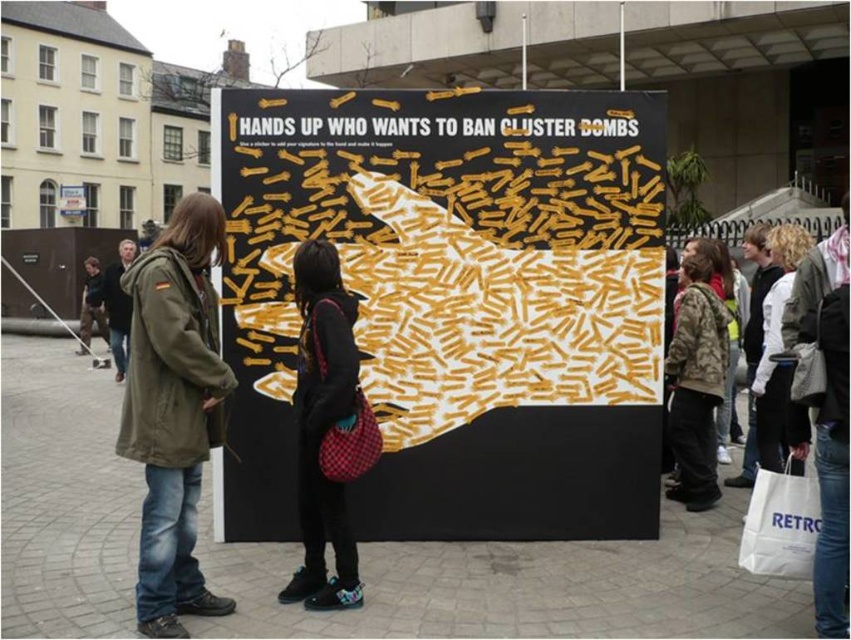
Does yellow paper cluster bombs at center have a smaller size compared to camouflage jacket at center?

No.

Is yellow paper cluster bombs at center to the right of camouflage jacket at center from the viewer's perspective?

Incorrect, yellow paper cluster bombs at center is not on the right side of camouflage jacket at center.

You are a GUI agent. You are given a task and a screenshot of the screen. Output one action in this format:
    pyautogui.click(x=<x>, y=<y>)
    Task: Click on the yellow paper cluster bombs at center
    
    Given the screenshot: What is the action you would take?
    pyautogui.click(x=455, y=304)

Is point (146, 596) more distant than point (706, 497)?

No, (146, 596) is closer to viewer.

Who is more distant from viewer, [181,288] or [721,385]?

Positioned behind is point [721,385].

You are a GUI agent. You are given a task and a screenshot of the screen. Output one action in this format:
    pyautogui.click(x=<x>, y=<y>)
    Task: Click on the olive green parka at center
    
    Given the screenshot: What is the action you would take?
    pyautogui.click(x=174, y=408)

Locate an element on the screen. olive green parka at center is located at coordinates (174, 408).

Does olive green parka at center have a lesser height compared to dark brown leather jacket at center?

No.

Is point (123, 440) positioned before point (104, 330)?

Yes, it is in front of point (104, 330).

Does point (130, 305) come closer to viewer compared to point (96, 296)?

Yes, point (130, 305) is in front of point (96, 296).

Find the location of a particular element. olive green parka at center is located at coordinates [x=174, y=408].